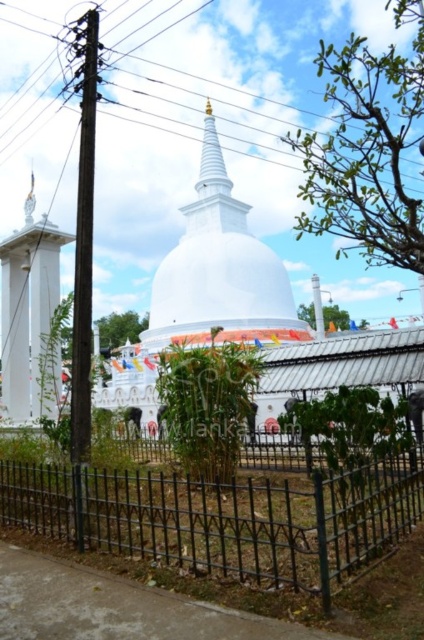
Between black plastic power line at upper center and gold polished stupa at center, which one is positioned higher?

Positioned higher is black plastic power line at upper center.

Can you confirm if black plastic power line at upper center is wider than gold polished stupa at center?

Correct, the width of black plastic power line at upper center exceeds that of gold polished stupa at center.

Between point (314, 106) and point (209, 109), which one is positioned in front?

Point (209, 109) is more forward.

The width and height of the screenshot is (424, 640). I want to click on black plastic power line at upper center, so click(169, 104).

Based on the photo, can you confirm if black plastic power line at upper center is smaller than black wrought iron fence at lower center?

No.

Can you confirm if black plastic power line at upper center is wider than black wrought iron fence at lower center?

Correct, the width of black plastic power line at upper center exceeds that of black wrought iron fence at lower center.

Is point (206, 16) farther from camera compared to point (162, 548)?

Yes, it is.

The image size is (424, 640). Identify the location of black plastic power line at upper center. (169, 104).

Measure the distance between point (198, 500) and camera.

The distance of point (198, 500) from camera is 42.80 feet.

What do you see at coordinates (223, 516) in the screenshot? I see `black wrought iron fence at lower center` at bounding box center [223, 516].

Locate an element on the screen. This screenshot has width=424, height=640. black wrought iron fence at lower center is located at coordinates (223, 516).